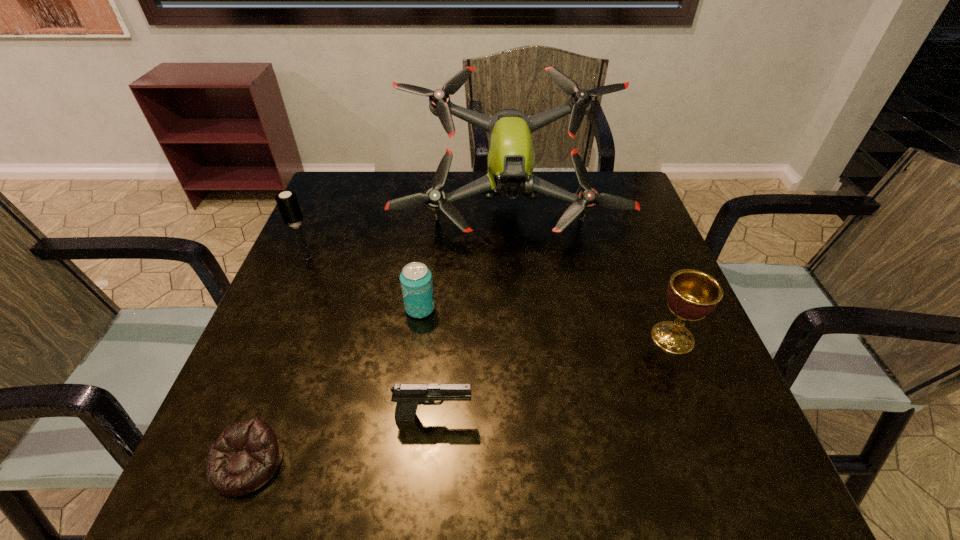
Where is `the tallest object`? The image size is (960, 540). the tallest object is located at coordinates (511, 159).

The image size is (960, 540). I want to click on the fifth shortest object, so click(x=287, y=202).

Where is `the third nearest object`? This screenshot has height=540, width=960. the third nearest object is located at coordinates (691, 294).

Where is `the third tallest object`? The width and height of the screenshot is (960, 540). the third tallest object is located at coordinates (691, 294).

The height and width of the screenshot is (540, 960). What are the coordinates of `beer can` in the screenshot? It's located at (416, 279).

You are a GUI agent. You are given a task and a screenshot of the screen. Output one action in this format:
    pyautogui.click(x=<x>, y=<y>)
    Task: Click on the second nearest object
    
    Given the screenshot: What is the action you would take?
    pyautogui.click(x=408, y=396)

The image size is (960, 540). What are the coordinates of `pistol` in the screenshot? It's located at (408, 396).

Locate an element on the screen. the shortest object is located at coordinates (246, 455).

Where is `beanbag`? This screenshot has height=540, width=960. beanbag is located at coordinates (246, 455).

Where is `free space located 0.110m on the front-facing side of the drone`? free space located 0.110m on the front-facing side of the drone is located at coordinates (514, 285).